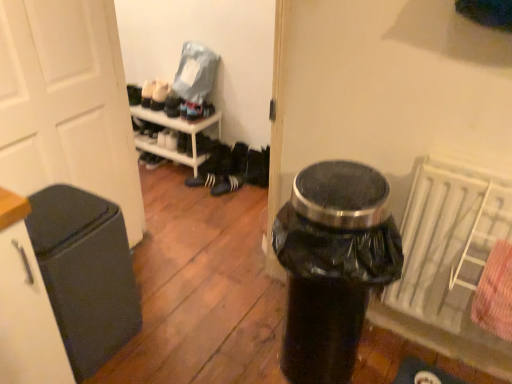
Locate an element on the screen. Image resolution: width=512 pixels, height=384 pixels. vacant space to the right of white matte door at left is located at coordinates (179, 302).